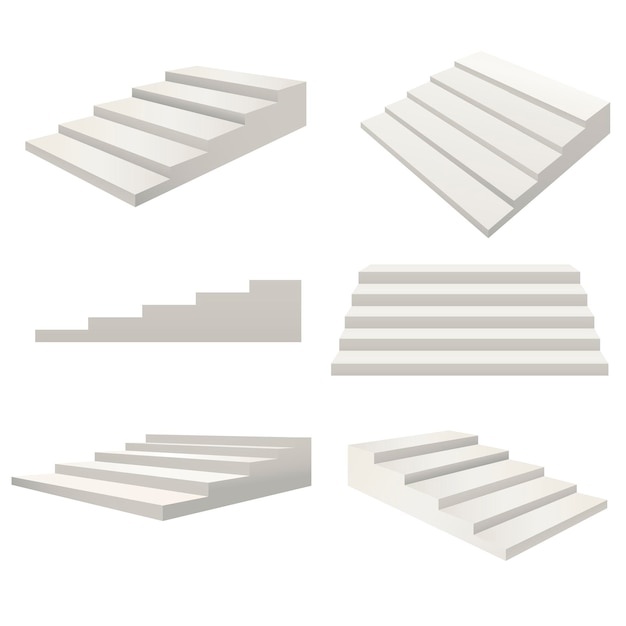
Locate an element on the screen. staircases is located at coordinates point(188,101), point(446,155), point(233,327), point(404,331), point(233,458), point(449,484).